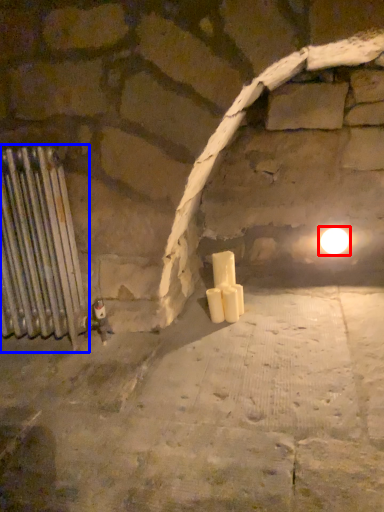
Question: Which point is further to the camera, light (highlighted by a red box) or radiator (highlighted by a blue box)?

Choices:
 (A) light
 (B) radiator

Answer: (A)